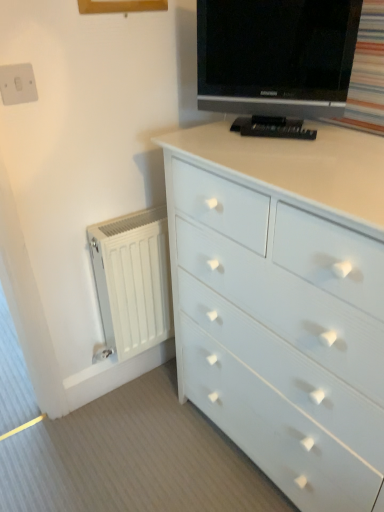
Where is `free spot above white painted wood chest of drawers at center (from a real-world perspective)`? The height and width of the screenshot is (512, 384). free spot above white painted wood chest of drawers at center (from a real-world perspective) is located at coordinates (304, 154).